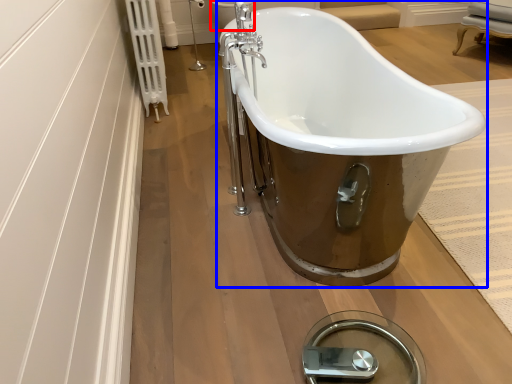
Question: Among these objects, which one is nearest to the camera, toilet bowl (highlighted by a red box) or bathtub (highlighted by a blue box)?

Choices:
 (A) toilet bowl
 (B) bathtub

Answer: (B)